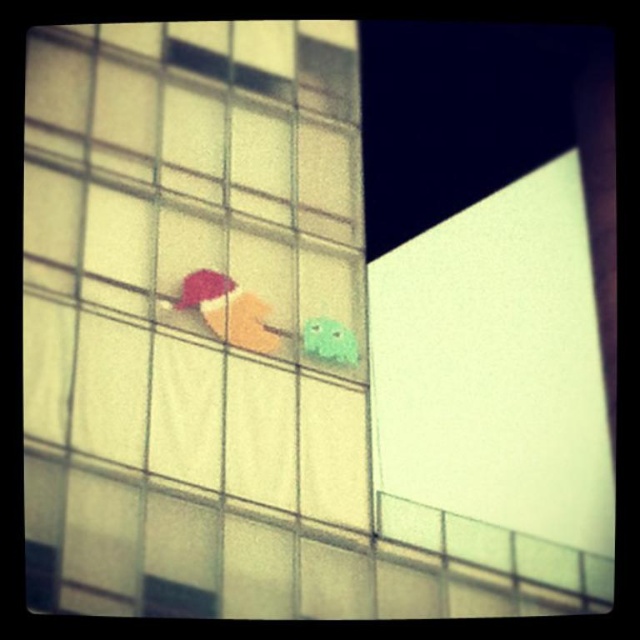
Between matte plastic ice cream cone at center and green matte toy at center, which one appears on the left side from the viewer's perspective?

matte plastic ice cream cone at center

Which is behind, point (280, 333) or point (310, 333)?

Positioned behind is point (310, 333).

Locate an element on the screen. matte plastic ice cream cone at center is located at coordinates (228, 310).